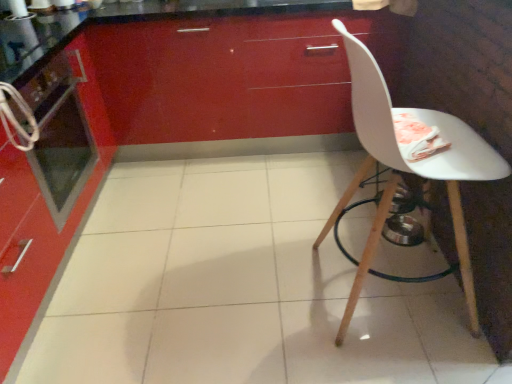
Question: From the image's perspective, does glossy red cabinet at upper center appear lower than metallic oven at left?

Choices:
 (A) no
 (B) yes

Answer: (A)

Question: Does glossy red cabinet at upper center have a lesser width compared to metallic oven at left?

Choices:
 (A) yes
 (B) no

Answer: (B)

Question: Is glossy red cabinet at upper center not inside metallic oven at left?

Choices:
 (A) no
 (B) yes

Answer: (B)

Question: Does glossy red cabinet at upper center turn towards metallic oven at left?

Choices:
 (A) yes
 (B) no

Answer: (A)

Question: Is glossy red cabinet at upper center shorter than metallic oven at left?

Choices:
 (A) yes
 (B) no

Answer: (B)

Question: Is point (87, 130) closer or farther from the camera than point (258, 132)?

Choices:
 (A) closer
 (B) farther

Answer: (A)

Question: Is metallic oven at left inside or outside of glossy red cabinet at upper center?

Choices:
 (A) outside
 (B) inside

Answer: (A)

Question: Is metallic oven at left wider or thinner than glossy red cabinet at upper center?

Choices:
 (A) thin
 (B) wide

Answer: (A)

Question: From their relative heights in the image, would you say metallic oven at left is taller or shorter than glossy red cabinet at upper center?

Choices:
 (A) short
 (B) tall

Answer: (A)

Question: Visually, is glossy red cabinet at upper center positioned to the left or to the right of metallic oven at left?

Choices:
 (A) left
 (B) right

Answer: (B)

Question: Is glossy red cabinet at upper center in front of or behind metallic oven at left in the image?

Choices:
 (A) front
 (B) behind

Answer: (B)

Question: Considering the positions of point (211, 132) and point (37, 175), is point (211, 132) closer or farther from the camera than point (37, 175)?

Choices:
 (A) closer
 (B) farther

Answer: (B)

Question: Considering the positions of glossy red cabinet at upper center and metallic oven at left in the image, is glossy red cabinet at upper center taller or shorter than metallic oven at left?

Choices:
 (A) tall
 (B) short

Answer: (A)

Question: Based on their positions, is white matte chair at right located to the left or right of metallic oven at left?

Choices:
 (A) left
 (B) right

Answer: (B)

Question: Considering the positions of white matte chair at right and metallic oven at left in the image, is white matte chair at right wider or thinner than metallic oven at left?

Choices:
 (A) thin
 (B) wide

Answer: (B)